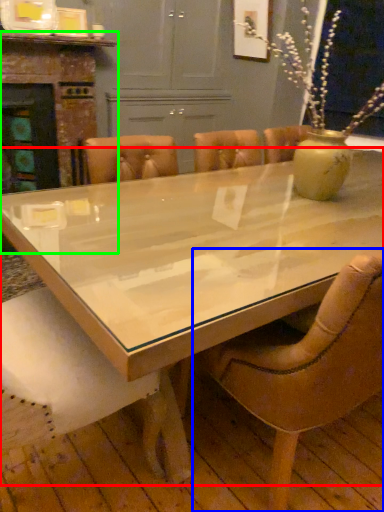
Question: Based on their relative distances, which object is farther from coffee table (highlighted by a red box)? Choose from chair (highlighted by a blue box) and fireplace (highlighted by a green box).

Choices:
 (A) chair
 (B) fireplace

Answer: (B)